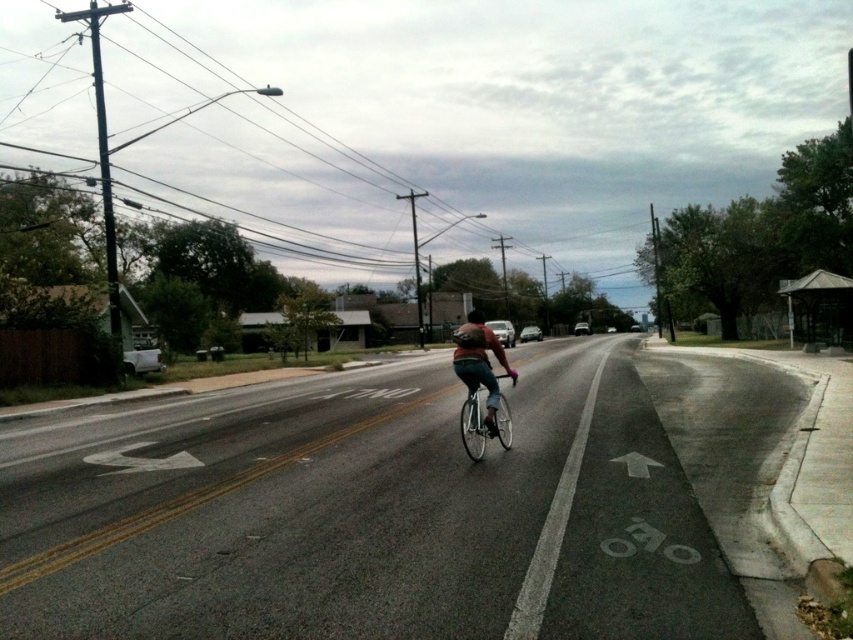
Question: Is black asphalt bike lane at center thinner than black matte bicycle helmet at center?

Choices:
 (A) no
 (B) yes

Answer: (A)

Question: From the image, what is the correct spatial relationship of silver metallic bicycle at center in relation to black matte bicycle helmet at center?

Choices:
 (A) below
 (B) above

Answer: (A)

Question: Based on their relative distances, which object is nearer to the black asphalt bike lane at center?

Choices:
 (A) matte black bicycle at center
 (B) black matte bicycle helmet at center
 (C) silver metallic bicycle at center

Answer: (C)

Question: Among these objects, which one is farthest from the camera?

Choices:
 (A) matte black bicycle at center
 (B) black matte bicycle helmet at center
 (C) black asphalt bike lane at center
 (D) silver metallic bicycle at center

Answer: (B)

Question: Which object is the farthest from the black asphalt bike lane at center?

Choices:
 (A) black matte bicycle helmet at center
 (B) silver metallic bicycle at center
 (C) matte black bicycle at center

Answer: (A)

Question: Is black asphalt bike lane at center smaller than matte black bicycle at center?

Choices:
 (A) yes
 (B) no

Answer: (A)